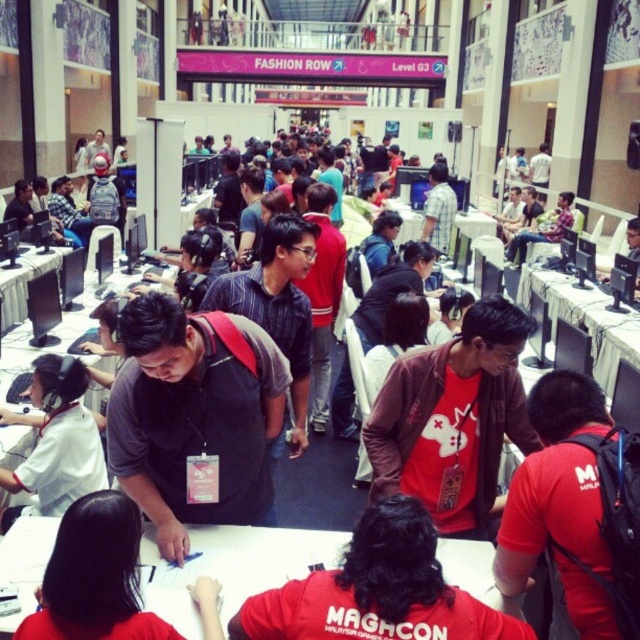
You are standing at the entrance of the convention hall and want to reach the registration desk. The registration desk is located at point (99, 460). However, there is an obstacle at point (474, 362). Can you walk directly towards the registration desk without going around the obstacle?

Point (474, 362) is behind point (99, 460), so you can walk directly towards the registration desk at point (99, 460) without needing to go around the obstacle at point (474, 362) since the obstacle is behind the target location.

In the scene shown: You are attending the MAGHCON event and need to locate the volunteer with the dark gray shirt at center. From the white plastic table at left, in which direction should you look to find them?

The dark gray shirt at center is to the right of the white plastic table at left, so you should look to the right of the white plastic table at left to find them.